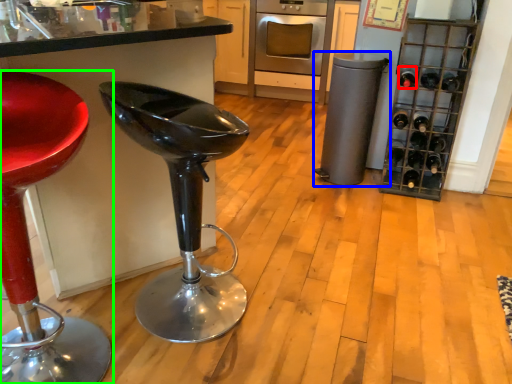
Question: Considering the real-world distances, which object is closest to wine bottle (highlighted by a red box)? appliance (highlighted by a blue box) or chair (highlighted by a green box).

Choices:
 (A) appliance
 (B) chair

Answer: (A)